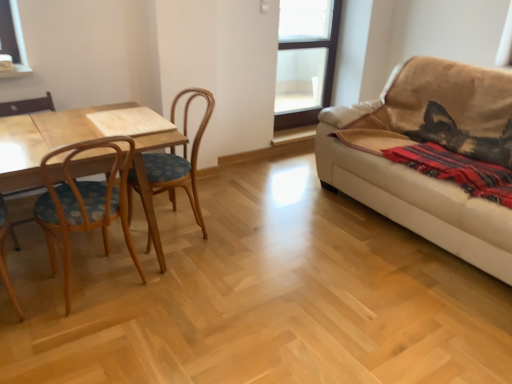
Where is `vacant space to the right of wooden chair at left`? This screenshot has width=512, height=384. vacant space to the right of wooden chair at left is located at coordinates (95, 335).